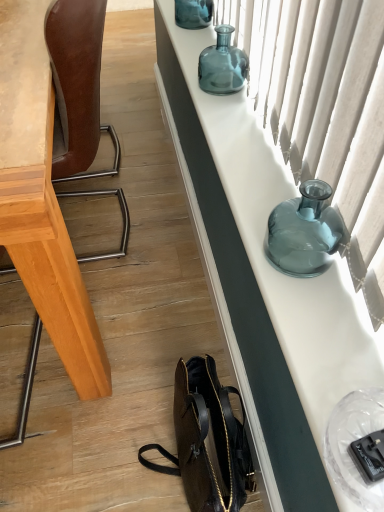
At what (x,y) coordinates should I click in order to perform the action: click on free space that is in between teal glass vase at upper center, the 3th bottle viewed from the front, and translucent glass vase at upper right, positioned as the 1th bottle in front-to-back order. Please return your answer as a coordinate pair (x, y). This screenshot has width=384, height=512. Looking at the image, I should click on (243, 127).